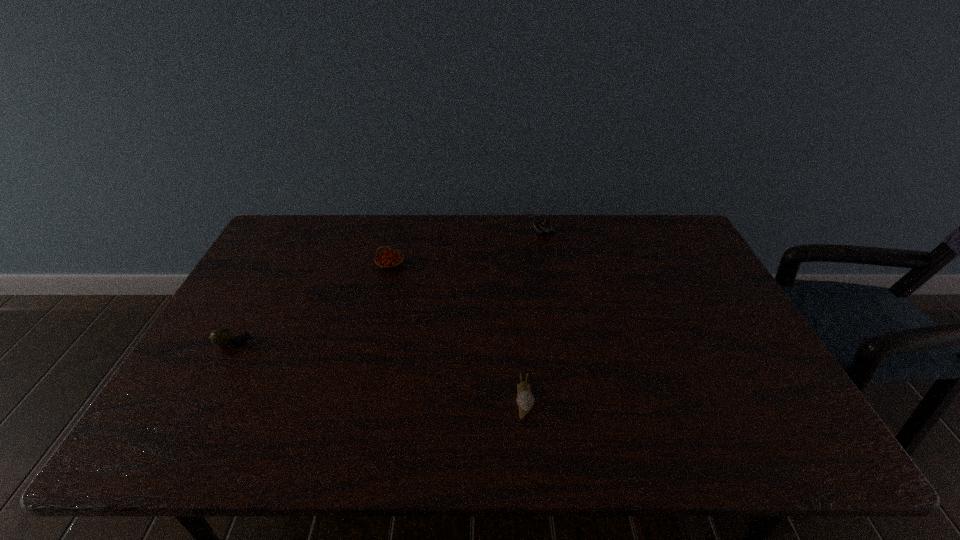
The image size is (960, 540). I want to click on vacant area at the far right corner of the desktop, so click(652, 225).

Locate an element on the screen. This screenshot has width=960, height=540. free space at the near right corner of the desktop is located at coordinates (802, 439).

You are a GUI agent. You are given a task and a screenshot of the screen. Output one action in this format:
    pyautogui.click(x=<x>, y=<y>)
    Task: Click on the unoccupied area between the rightmost object and the second escargot from right to left
    This screenshot has width=960, height=540.
    Given the screenshot: What is the action you would take?
    pyautogui.click(x=532, y=316)

The width and height of the screenshot is (960, 540). What are the coordinates of `free area in between the nearest object and the second nearest object` in the screenshot? It's located at (380, 372).

Locate an element on the screen. Image resolution: width=960 pixels, height=540 pixels. free space between the nearest object and the leftmost escargot is located at coordinates (380, 372).

Identify the location of free area in between the leftmost object and the tallest object. (389, 288).

This screenshot has height=540, width=960. Find the location of `free spot between the second tallest object and the nearest escargot`. free spot between the second tallest object and the nearest escargot is located at coordinates (457, 332).

Locate an element on the screen. The image size is (960, 540). empty space that is in between the farthest escargot and the strawberry is located at coordinates [x=466, y=248].

Identify the location of free space between the nearest object and the second farthest escargot. (380, 372).

Where is `unoccupied position between the second object from left to right and the second nearest escargot`? unoccupied position between the second object from left to right and the second nearest escargot is located at coordinates (314, 304).